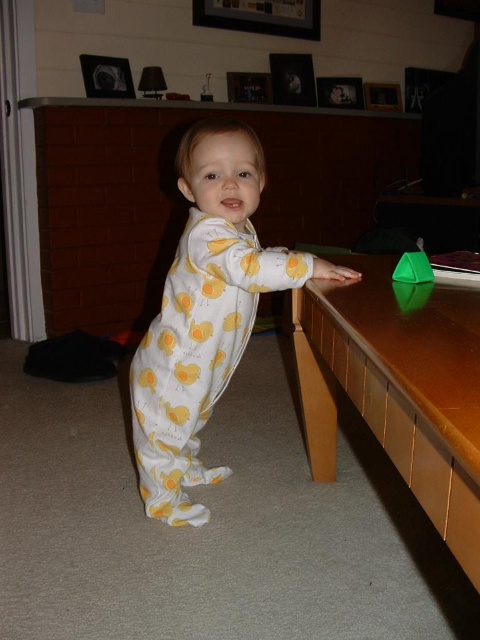
You are a drone operator trying to navigate a small drone through a room. The drone must fly from the point at coordinates point [403,365] to the point at coordinates point [403,256]. According to the image description, will the drone have to move forward or backward to reach its destination?

The point [403,365] is in front of point [403,256], so the drone will have to move backward to reach the destination.